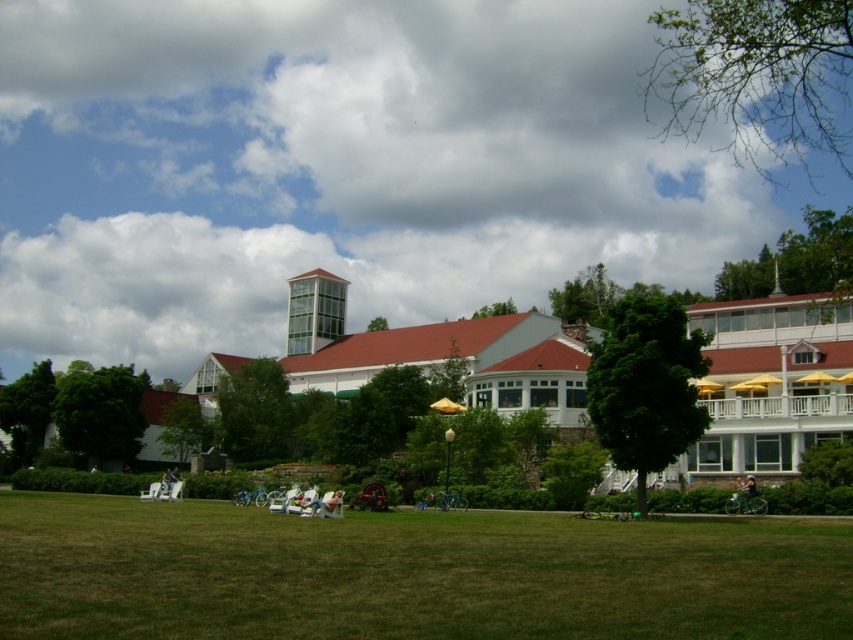
Is cloudy sky at upper center in front of green grass at lower center?

No, it is behind green grass at lower center.

Does cloudy sky at upper center have a greater height compared to green grass at lower center?

Yes, cloudy sky at upper center is taller than green grass at lower center.

Locate an element on the screen. The height and width of the screenshot is (640, 853). cloudy sky at upper center is located at coordinates (340, 168).